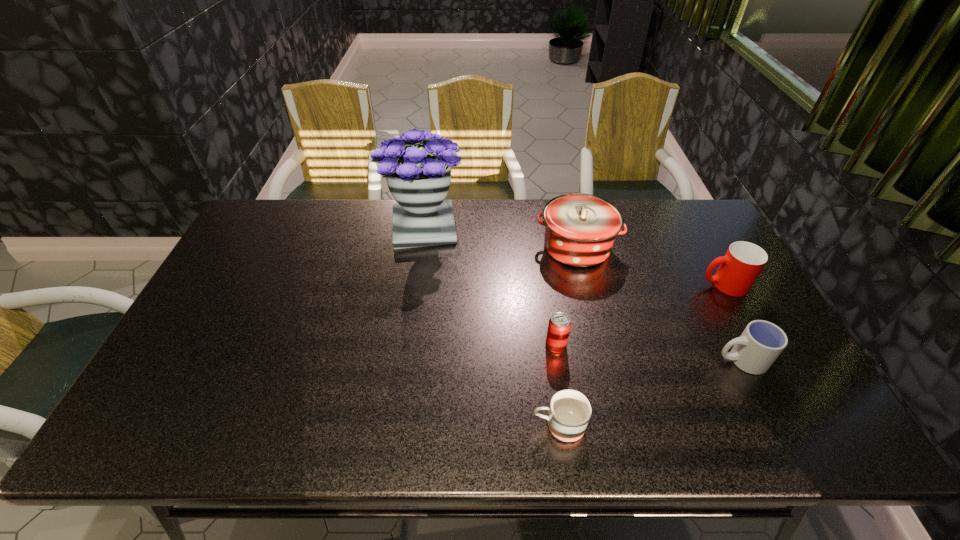
Where is `vacant space in between the shortest object and the fourth shortest object`? vacant space in between the shortest object and the fourth shortest object is located at coordinates (641, 355).

The image size is (960, 540). Find the location of `vacant space that's between the tallest object and the can`. vacant space that's between the tallest object and the can is located at coordinates (490, 286).

This screenshot has width=960, height=540. In order to click on free spot between the shorter cup and the casserole in this screenshot , I will do `click(659, 303)`.

Locate an element on the screen. unoccupied area between the bouquet and the nearest object is located at coordinates (492, 327).

Where is `empty space that is in between the shorter cup and the taller cup`? empty space that is in between the shorter cup and the taller cup is located at coordinates (732, 322).

Find the location of a particular element. free space between the can and the mug is located at coordinates (557, 385).

Find the location of `vacant space in between the nearer cup and the bouquet`. vacant space in between the nearer cup and the bouquet is located at coordinates 583,294.

Locate an element on the screen. This screenshot has width=960, height=540. object that is the closest to the mug is located at coordinates (559, 326).

Where is `object that ranks as the fourth closest to the second tallest object`? object that ranks as the fourth closest to the second tallest object is located at coordinates (761, 342).

This screenshot has width=960, height=540. In order to click on vacant region that satisfies the following two spatial constraints: 1. on the back side of the second tallest object; 2. on the left side of the can in this screenshot , I will do `click(541, 247)`.